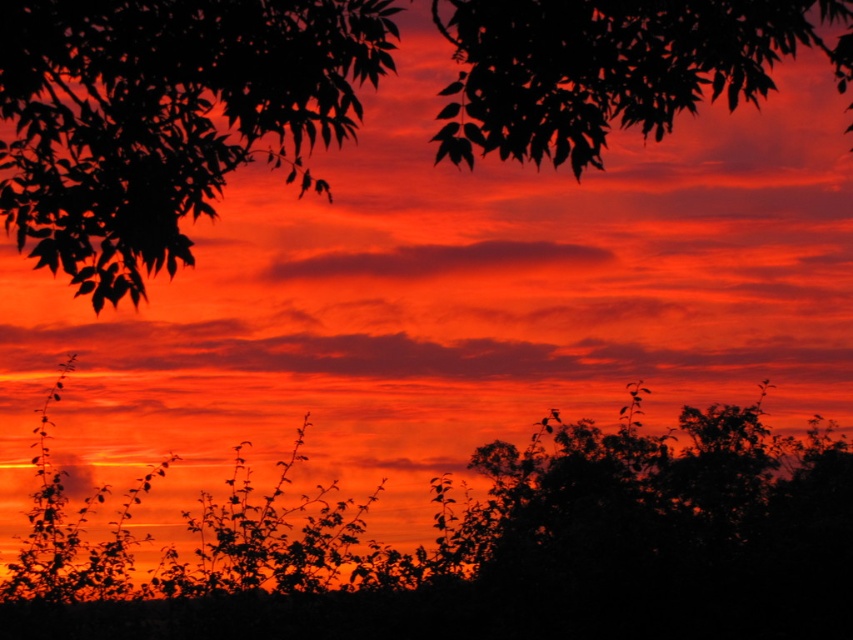
Looking at this image, between silky leaves at upper left and matte orange cloud at center, which one appears on the right side from the viewer's perspective?

matte orange cloud at center is more to the right.

Looking at this image, can you confirm if silky leaves at upper left is positioned to the left of matte orange cloud at center?

Indeed, silky leaves at upper left is positioned on the left side of matte orange cloud at center.

Describe the element at coordinates (165, 116) in the screenshot. I see `silky leaves at upper left` at that location.

Image resolution: width=853 pixels, height=640 pixels. Find the location of `silky leaves at upper left`. silky leaves at upper left is located at coordinates (165, 116).

Is silhouette leafy tree at upper left to the right of silky leaves at upper left from the viewer's perspective?

Correct, you'll find silhouette leafy tree at upper left to the right of silky leaves at upper left.

Who is higher up, silhouette leafy tree at upper left or silky leaves at upper left?

silky leaves at upper left is above.

Identify the location of silhouette leafy tree at upper left. (483, 547).

Measure the distance between point (693, 508) and camera.

Point (693, 508) and camera are 10.32 meters apart from each other.

Is point (167, 611) less distant than point (546, 260)?

Yes, point (167, 611) is closer to viewer.

Does point (543, 611) come farther from viewer compared to point (368, 272)?

No.

The width and height of the screenshot is (853, 640). What are the coordinates of `silhouette leafy tree at upper left` in the screenshot? It's located at (483, 547).